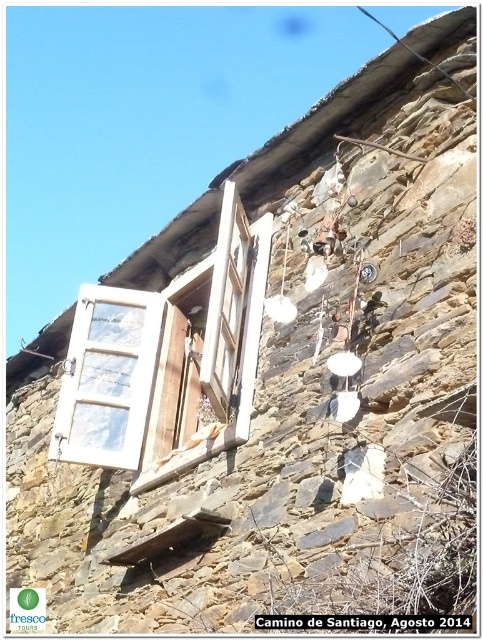
In the scene shown: You are an architect designing a renovation plan for this rustic stone wall. You need to install a new support beam that must be placed between the white plastic window at upper left and the white wood window at center. Since the beam requires equal space on both sides, which window should you position the beam closer to to ensure symmetry?

The white plastic window at upper left has a larger size compared to the white wood window at center. To achieve symmetry with equal space on both sides, the beam should be positioned closer to the larger white plastic window at upper left to balance the visual weight.

From the picture: You are an architect designing a new building and want to ensure that all windows have a minimum height of 1.5 meters. You observe the white plastic window at upper left and the white wood window at center in the image. Which window might not meet the height requirement based on their relative sizes?

The white plastic window at upper left has a lesser height compared to the white wood window at center, so it might not meet the minimum height requirement of 1.5 meters if the white wood window at center is already at or above the required height.

You are an architect designing a new building and want to place a decorative item exactly where the white plastic window at upper left is located. According to the coordinates provided, where should you place the decorative item?

The decorative item should be placed at the coordinates point (108, 378) where the white plastic window at upper left is located.